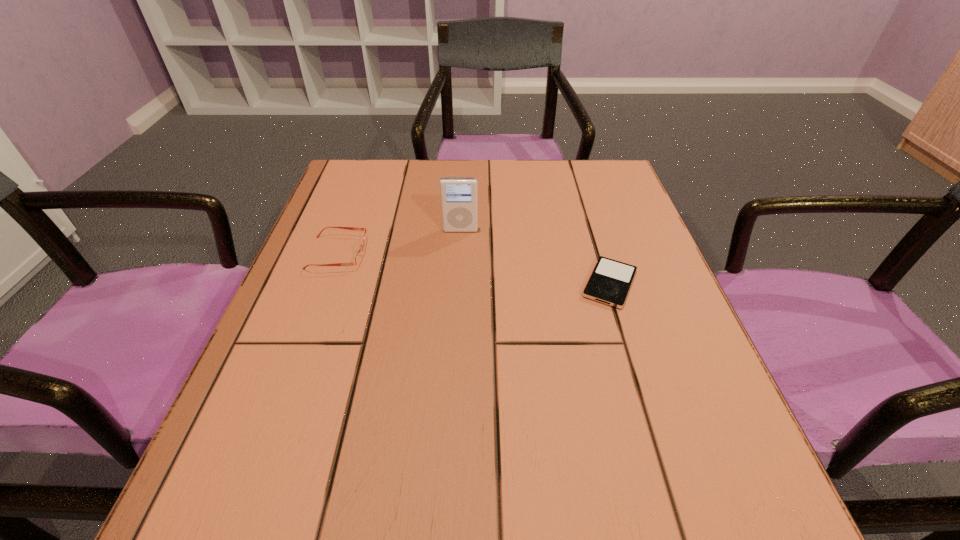
Identify the location of the taller iPod. (459, 203).

Locate an element on the screen. Image resolution: width=960 pixels, height=540 pixels. the second object from right to left is located at coordinates (459, 203).

What are the coordinates of `spectacles` in the screenshot? It's located at (358, 258).

Find the location of a particular element. the leftmost object is located at coordinates (358, 258).

Locate an element on the screen. Image resolution: width=960 pixels, height=540 pixels. the rightmost object is located at coordinates (610, 281).

You are a GUI agent. You are given a task and a screenshot of the screen. Output one action in this format:
    pyautogui.click(x=<x>, y=<y>)
    Task: Click on the nearer iPod
    The height and width of the screenshot is (540, 960).
    Given the screenshot: What is the action you would take?
    pyautogui.click(x=610, y=281)

In order to click on free point located on the front-facing side of the farthest object in this screenshot , I will do `click(455, 321)`.

Locate an element on the screen. The width and height of the screenshot is (960, 540). free space located 0.180m on the lenses of the leftmost object is located at coordinates (451, 253).

Where is `blank space located 0.080m on the back of the nearer iPod`? Image resolution: width=960 pixels, height=540 pixels. blank space located 0.080m on the back of the nearer iPod is located at coordinates (595, 237).

Find the location of a particular element. This screenshot has width=960, height=540. object at the left edge is located at coordinates (358, 258).